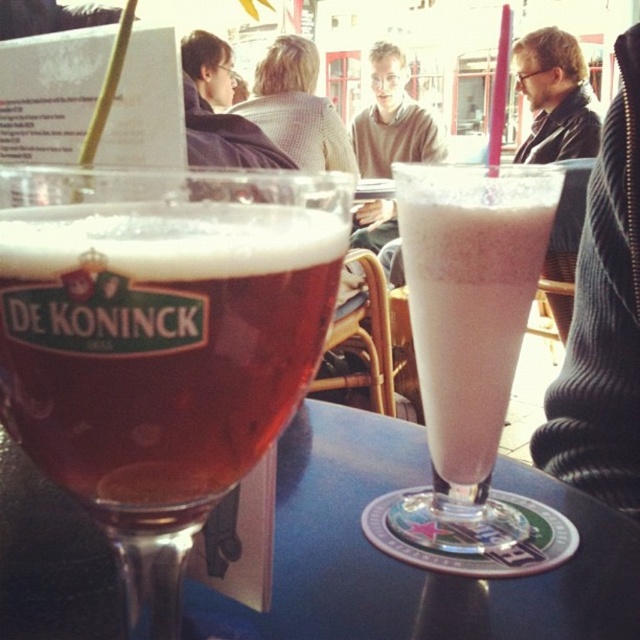
You are a customer at the outdoor cafe and want to grab both the translucent glass beer at center and the milky white frosted glass at center. Which one should you pick up first to avoid knocking over the other?

You should pick up the translucent glass beer at center first because it is positioned under the milky white frosted glass at center, so lifting the lower one first would prevent disturbing the upper glass.

You are a waiter at the outdoor cafe. You need to place a dessert plate between the translucent glass beer at center and the milky white frosted glass at center. The plate is 4 inches in diameter. Is there enough space between the two glasses to place the plate?

The distance between the translucent glass beer at center and the milky white frosted glass at center is 6.46 inches. Since the dessert plate is 4 inches in diameter, there is enough space to place it between them.